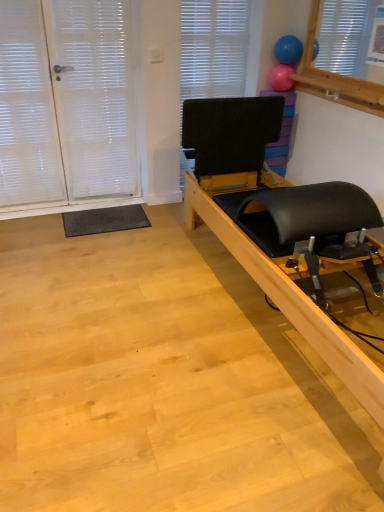
Identify the location of free region on the left part of black leather pilates reformer at right. This screenshot has width=384, height=512. (124, 292).